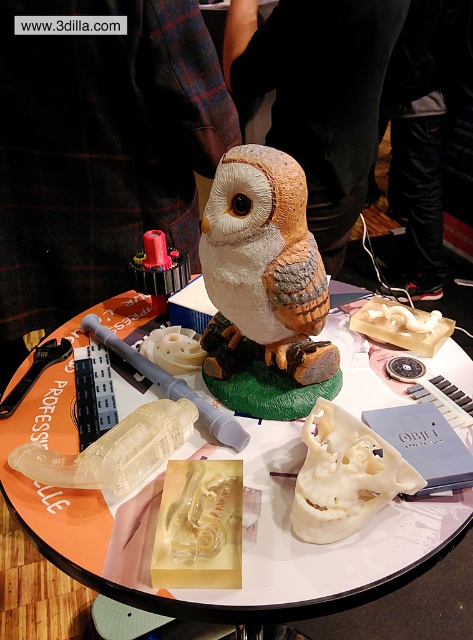
Does translucent plastic skull at center lie in front of matte clay owl at center?

Yes, translucent plastic skull at center is in front of matte clay owl at center.

The width and height of the screenshot is (473, 640). In order to click on translucent plastic skull at center in this screenshot , I will do `click(261, 545)`.